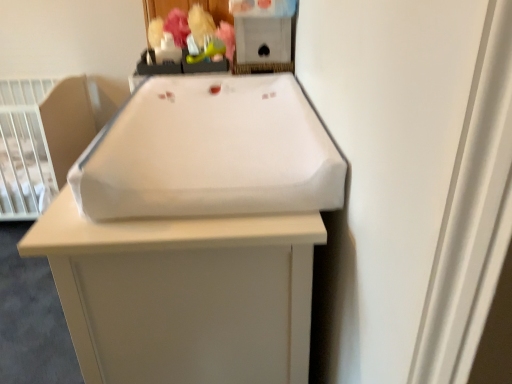
Question: From a real-world perspective, relative to white plastic infant bed at left, is green rubber toy at upper center, the 2th toy viewed from the left, vertically above or below?

Choices:
 (A) above
 (B) below

Answer: (A)

Question: Looking at the image, does green rubber toy at upper center, the 2th toy viewed from the left, seem bigger or smaller compared to white plastic infant bed at left?

Choices:
 (A) small
 (B) big

Answer: (A)

Question: Estimate the real-world distances between objects in this image. Which object is closer to the white fabric sink at center?

Choices:
 (A) matte plastic toy at upper center, arranged as the second toy when viewed from the right
 (B) white fabric changing pad at center
 (C) white plastic infant bed at left
 (D) green rubber toy at upper center, the 2th toy viewed from the left

Answer: (B)

Question: Estimate the real-world distances between objects in this image. Which object is closer to the matte plastic toy at upper center, the first toy viewed from the left?

Choices:
 (A) white fabric sink at center
 (B) white fabric changing pad at center
 (C) white plastic infant bed at left
 (D) green rubber toy at upper center, acting as the first toy starting from the right

Answer: (D)